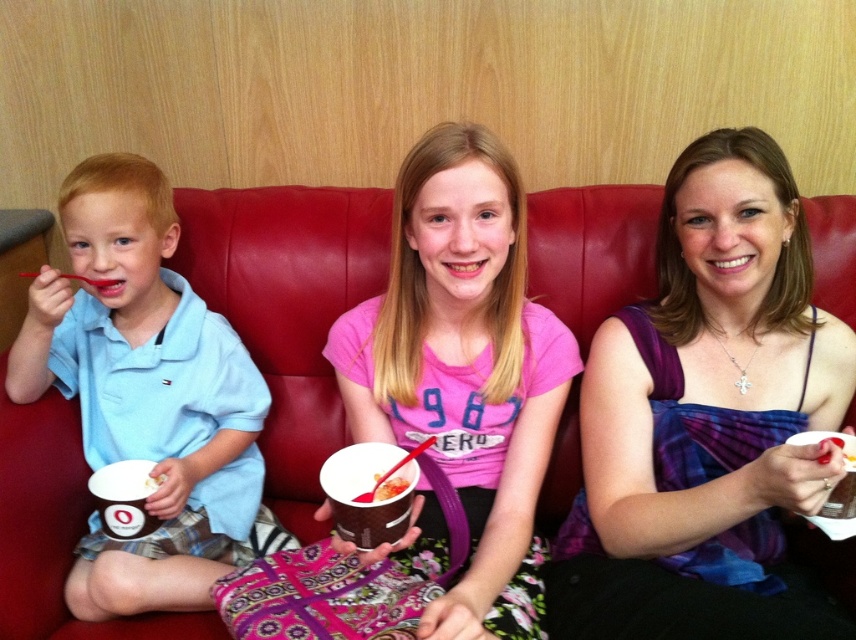
Question: Is purple satin dress at center thinner than red leather couch at center?

Choices:
 (A) no
 (B) yes

Answer: (A)

Question: Estimate the real-world distances between objects in this image. Which object is farther from the red leather couch at center?

Choices:
 (A) smooth chocolate ice cream at center
 (B) pink cotton shirt at center
 (C) purple satin dress at center

Answer: (C)

Question: Is pink cotton shirt at center positioned at the back of smooth chocolate ice cream at center?

Choices:
 (A) yes
 (B) no

Answer: (B)

Question: Which point is closer to the camera?

Choices:
 (A) (377, 484)
 (B) (449, 140)
 (C) (215, 435)
 (D) (697, 220)

Answer: (A)

Question: Which of the following is the farthest from the observer?

Choices:
 (A) (141, 259)
 (B) (610, 289)
 (C) (428, 515)
 (D) (395, 492)

Answer: (B)

Question: Is light blue cotton shirt at left further to the viewer compared to smooth chocolate ice cream at center?

Choices:
 (A) no
 (B) yes

Answer: (B)